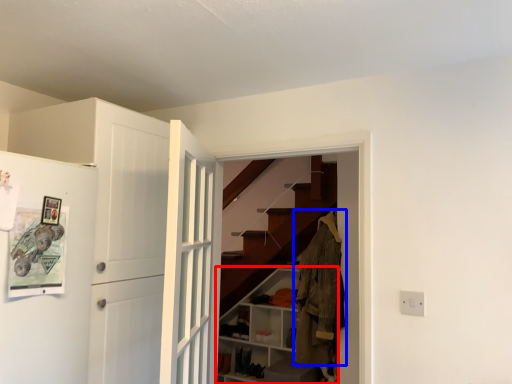
Question: Which of the following is the closest to the observer, cabinetry (highlighted by a red box) or clothing (highlighted by a blue box)?

Choices:
 (A) cabinetry
 (B) clothing

Answer: (B)